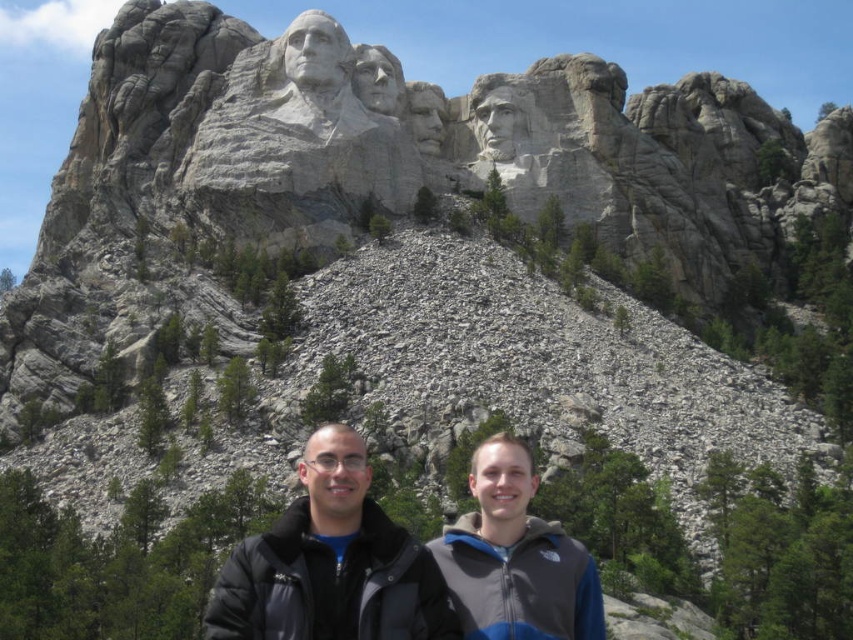
Is black jacket at center below granite statue at upper center?

Correct, black jacket at center is located below granite statue at upper center.

Who is lower down, black jacket at center or granite statue at upper center?

Positioned lower is black jacket at center.

What do you see at coordinates (412, 561) in the screenshot? I see `black jacket at center` at bounding box center [412, 561].

I want to click on black jacket at center, so click(412, 561).

Does black jacket at center have a greater width compared to gray fleece jacket at lower right?

Yes.

Is point (374, 540) farther from viewer compared to point (508, 461)?

No, (374, 540) is closer to viewer.

This screenshot has width=853, height=640. I want to click on black jacket at center, so click(412, 561).

Is point (469, 593) positioned in front of point (363, 113)?

Yes, point (469, 593) is closer to viewer.

What do you see at coordinates (515, 557) in the screenshot? Image resolution: width=853 pixels, height=640 pixels. I see `gray fleece jacket at lower right` at bounding box center [515, 557].

Identify the location of gray fleece jacket at lower right. (515, 557).